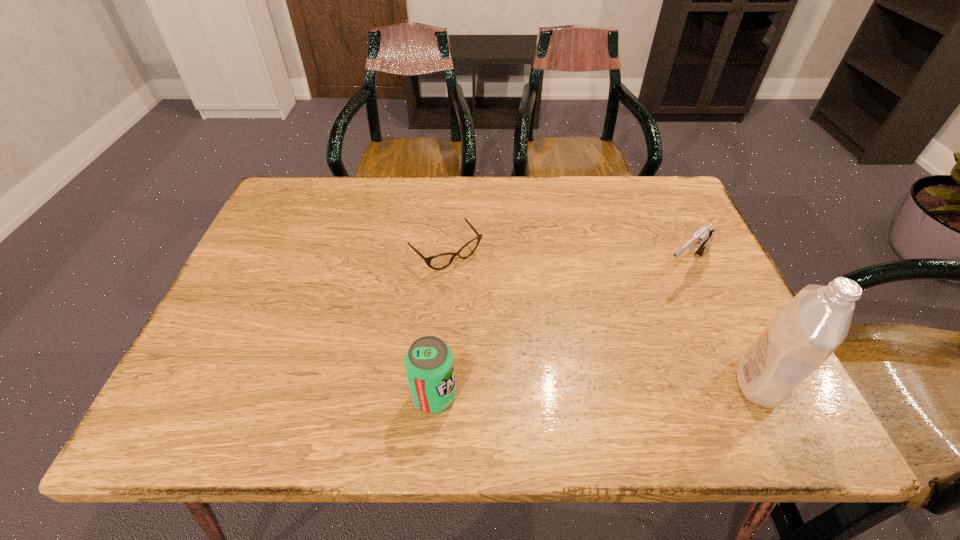
Locate an element on the screen. The width and height of the screenshot is (960, 540). vacant area situated 0.290m at the muzzle of the gun is located at coordinates (593, 350).

Where is `pop soda situated at the near edge`? pop soda situated at the near edge is located at coordinates (429, 364).

Locate an element on the screen. Image resolution: width=960 pixels, height=540 pixels. detergent at the near edge is located at coordinates (816, 321).

This screenshot has width=960, height=540. What are the coordinates of `detergent that is at the right edge` in the screenshot? It's located at (816, 321).

The height and width of the screenshot is (540, 960). Identify the location of gun that is positioned at the right edge. pos(700,242).

Find the location of a particular element. object present at the near right corner is located at coordinates (816, 321).

Find the location of `vacant area at the far edge`. vacant area at the far edge is located at coordinates (347, 180).

This screenshot has width=960, height=540. In order to click on vacant space at the left edge of the desktop in this screenshot , I will do `click(271, 316)`.

Where is `vacant space at the right edge`? vacant space at the right edge is located at coordinates (665, 278).

You are a GUI agent. You are given a task and a screenshot of the screen. Output one action in this format:
    pyautogui.click(x=<x>, y=<y>)
    Task: Click on the vacant space at the far left corner of the desktop
    
    Given the screenshot: What is the action you would take?
    pyautogui.click(x=291, y=214)